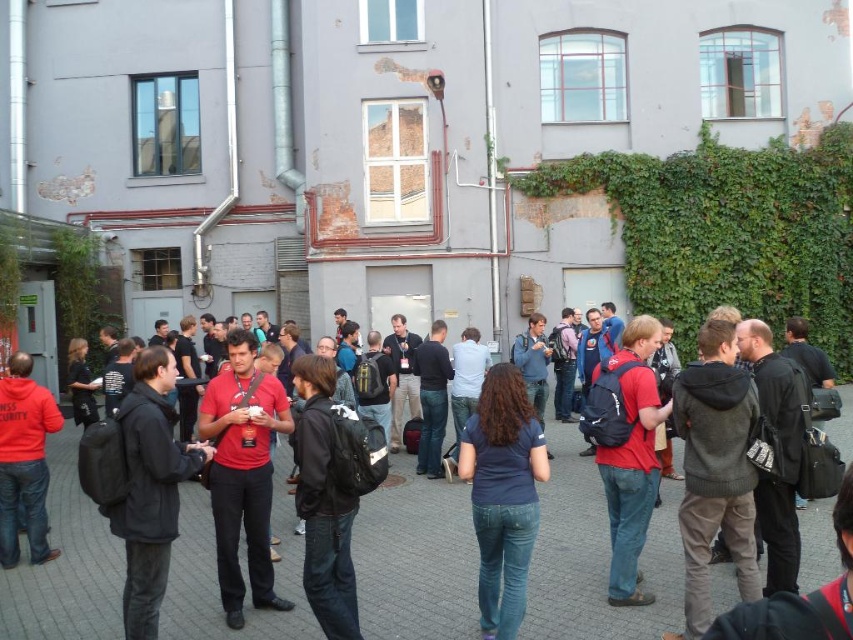
Question: Is black backpack at center thinner than green leafy ivy at center right?

Choices:
 (A) yes
 (B) no

Answer: (B)

Question: Is black backpack at center further to the viewer compared to green leafy ivy at center right?

Choices:
 (A) no
 (B) yes

Answer: (A)

Question: Can you confirm if black backpack at center is wider than green leafy ivy at center right?

Choices:
 (A) no
 (B) yes

Answer: (B)

Question: Which of the following is the farthest from the observer?

Choices:
 (A) (724, 275)
 (B) (65, 627)

Answer: (A)

Question: Which of the following is the farthest from the observer?

Choices:
 (A) green leafy ivy at center right
 (B) black backpack at center

Answer: (A)